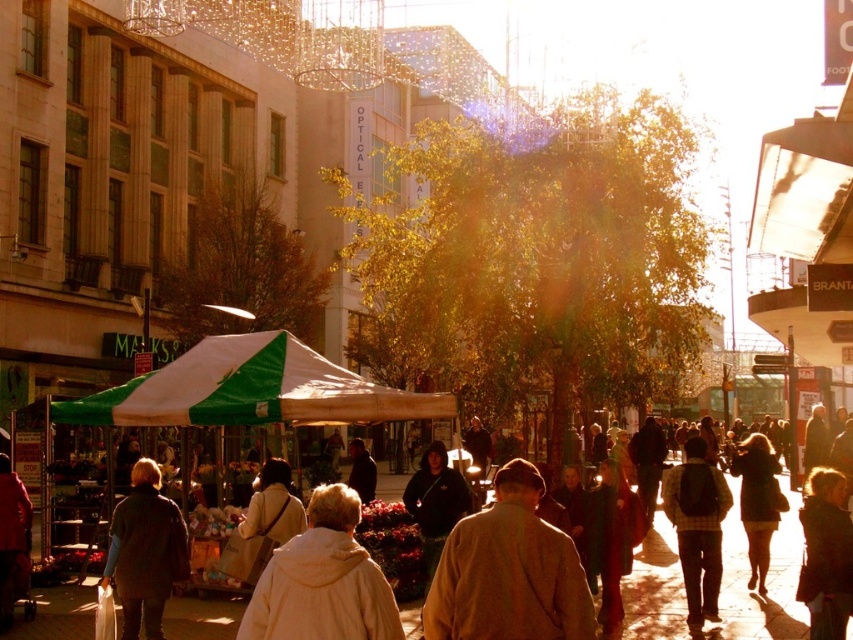
Which is below, green/white fabric canopy at center or dark brown leather jacket at lower left?

dark brown leather jacket at lower left is below.

Identify the location of green/white fabric canopy at center. (250, 388).

What are the coordinates of `green/white fabric canopy at center` in the screenshot? It's located at (250, 388).

Between dark brown leather jacket at lower left and plaid shirt at center, which one appears on the left side from the viewer's perspective?

dark brown leather jacket at lower left is more to the left.

Is dark brown leather jacket at lower left to the right of plaid shirt at center from the viewer's perspective?

No, dark brown leather jacket at lower left is not to the right of plaid shirt at center.

Find the location of a particular element. dark brown leather jacket at lower left is located at coordinates (144, 552).

Can you confirm if dark brown leather jacket at lower left is taller than dark brown leather jacket at lower right?

Yes, dark brown leather jacket at lower left is taller than dark brown leather jacket at lower right.

Based on the photo, is dark brown leather jacket at lower left bigger than dark brown leather jacket at lower right?

Correct, dark brown leather jacket at lower left is larger in size than dark brown leather jacket at lower right.

Is point (142, 563) in front of point (764, 467)?

Yes.

Identify the location of dark brown leather jacket at lower left. Image resolution: width=853 pixels, height=640 pixels. tap(144, 552).